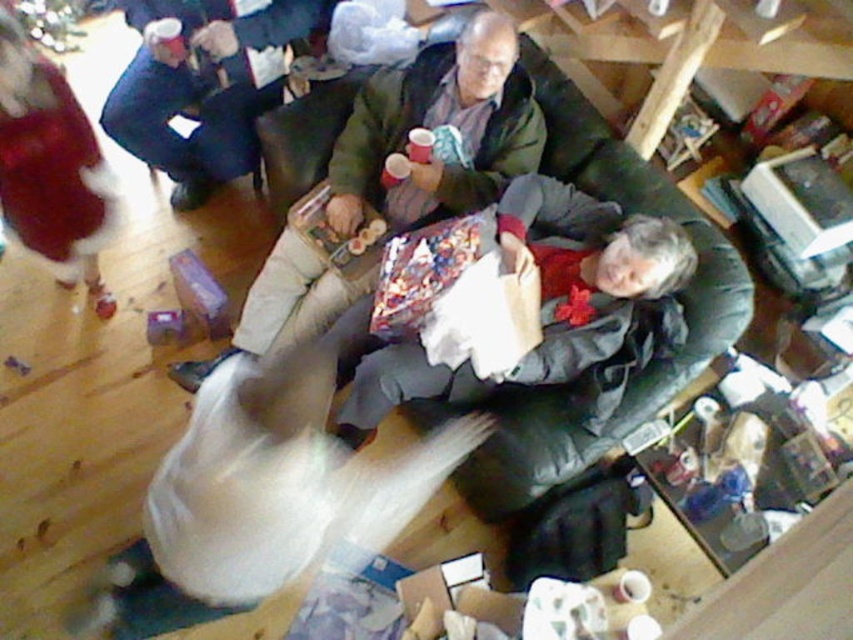
Question: Does green fabric jacket at center have a lesser width compared to green matte christmas tree at upper left?

Choices:
 (A) no
 (B) yes

Answer: (A)

Question: Can you confirm if green fabric jacket at center is smaller than dark green leather couch at center?

Choices:
 (A) yes
 (B) no

Answer: (A)

Question: Which object is farther from the camera taking this photo?

Choices:
 (A) dark blue jeans at upper left
 (B) green fabric jacket at center
 (C) green matte christmas tree at upper left

Answer: (C)

Question: Which object is farther from the camera taking this photo?

Choices:
 (A) dark green leather couch at center
 (B) dark blue jeans at upper left
 (C) green matte christmas tree at upper left

Answer: (C)

Question: Does dark green leather couch at center appear on the left side of dark blue jeans at upper left?

Choices:
 (A) yes
 (B) no

Answer: (B)

Question: Which point is closer to the camera?

Choices:
 (A) pyautogui.click(x=209, y=97)
 (B) pyautogui.click(x=611, y=182)
 (C) pyautogui.click(x=67, y=16)

Answer: (B)